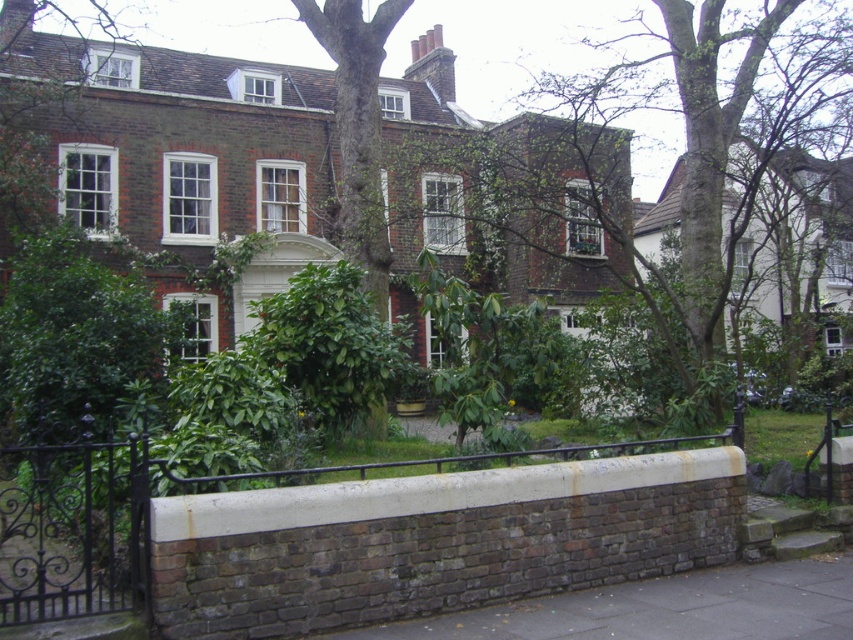
Is rusty brick wall at lower center bigger than brown brick pavement at lower center?

No, rusty brick wall at lower center is not bigger than brown brick pavement at lower center.

Where is `rusty brick wall at lower center`? This screenshot has height=640, width=853. rusty brick wall at lower center is located at coordinates (149, 513).

Identify the location of rusty brick wall at lower center. (149, 513).